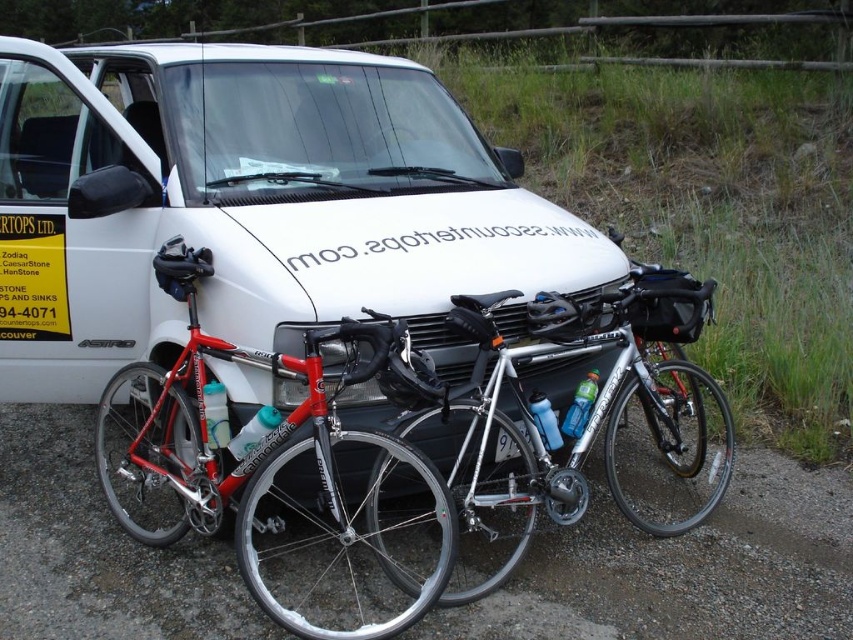
Between shiny red bike at center and silver metallic bicycle at center, which one has less height?

Standing shorter between the two is silver metallic bicycle at center.

In the scene shown: Is shiny red bike at center above silver metallic bicycle at center?

Correct, shiny red bike at center is located above silver metallic bicycle at center.

Is point (292, 444) positioned in front of point (650, 355)?

Yes, point (292, 444) is in front of point (650, 355).

Image resolution: width=853 pixels, height=640 pixels. Identify the location of shiny red bike at center. click(x=260, y=465).

Does point (13, 371) come closer to viewer compared to point (306, 541)?

No, it is behind (306, 541).

Between point (161, 349) and point (312, 406), which one is positioned behind?

The point (161, 349) is behind.

Where is `white matte van at center`? This screenshot has height=640, width=853. white matte van at center is located at coordinates (252, 205).

Does white matte van at center have a smaller size compared to silver metallic bicycle at center?

No.

Who is more forward, (9, 218) or (613, 477)?

Point (613, 477) is in front.

Which is behind, point (129, 84) or point (666, 493)?

Point (129, 84)

Image resolution: width=853 pixels, height=640 pixels. In order to click on white matte van at center in this screenshot , I will do `click(252, 205)`.